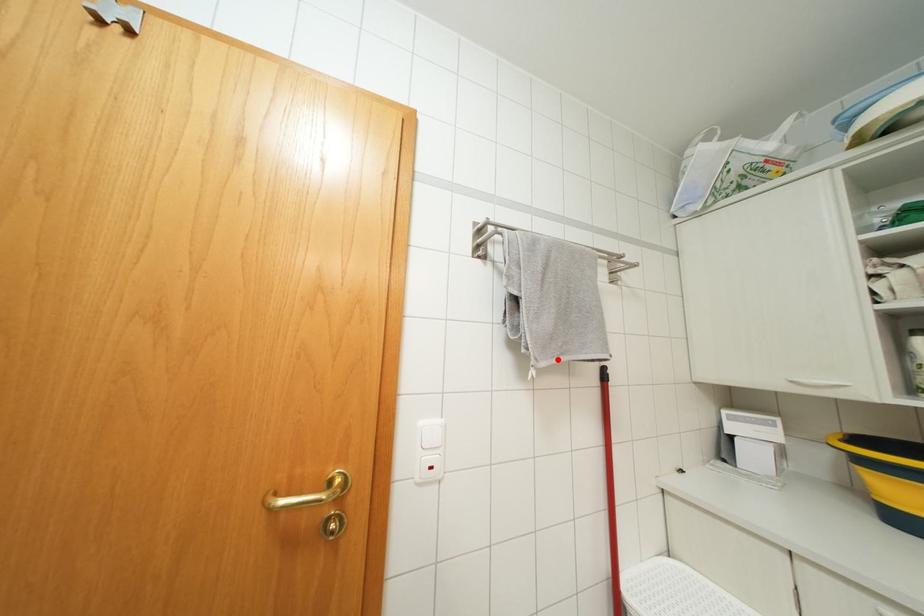
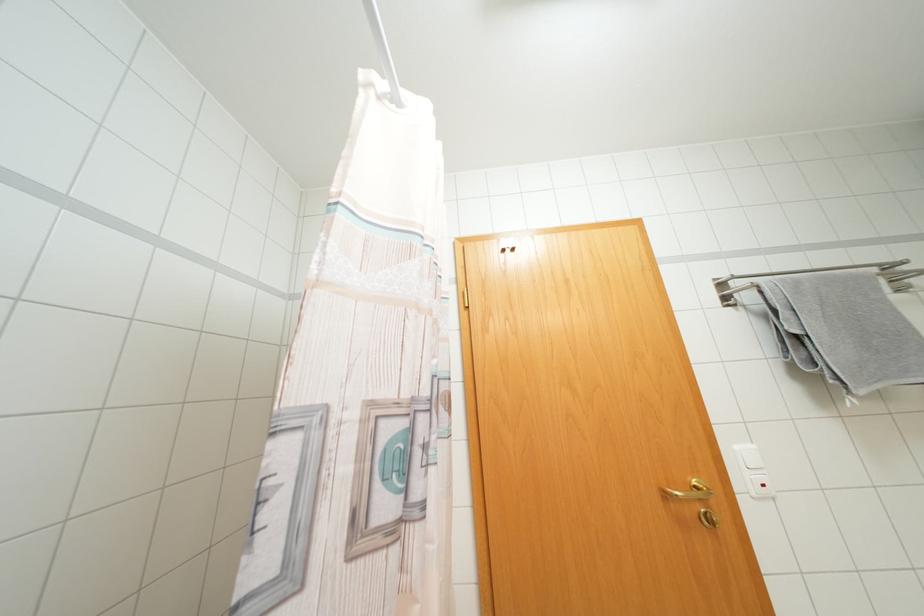
The point at the highlighted location is marked in the first image. Where is the corresponding point in the second image?

(877, 386)